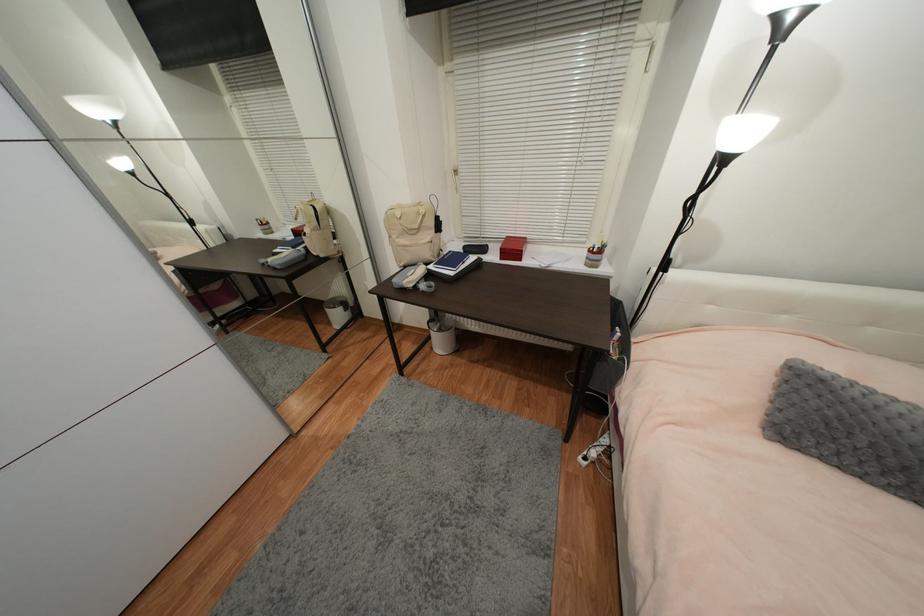
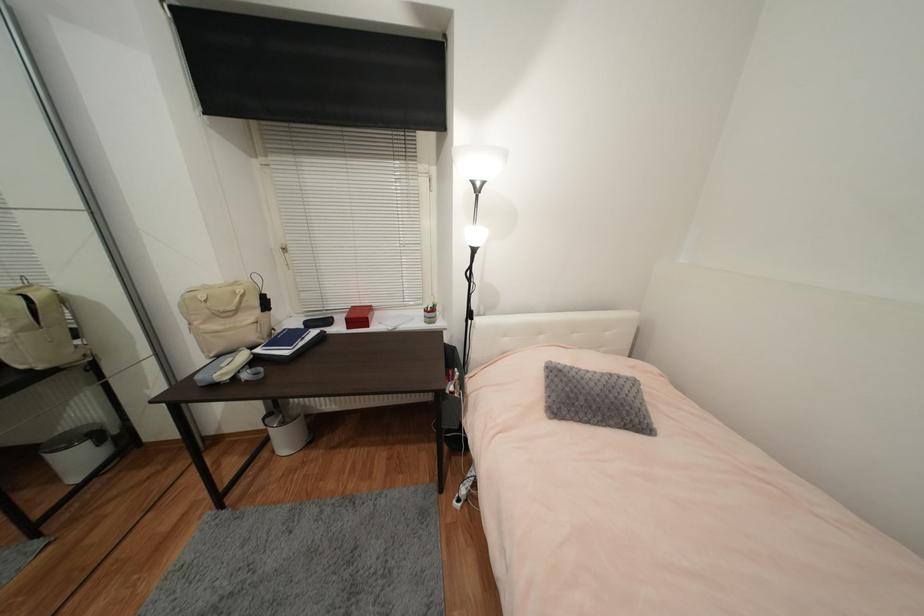
In the second image, find the point that corresponds to pixel 343 318 in the first image.

(83, 462)